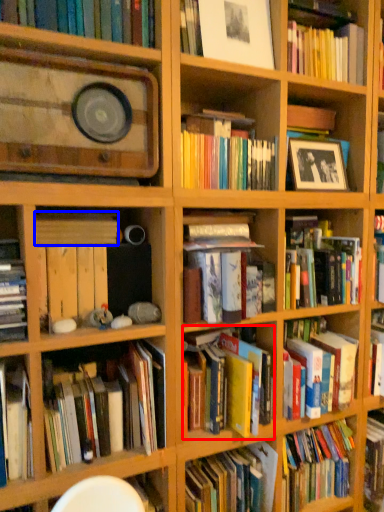
Question: Which object is closer to the camera taking this photo, book (highlighted by a red box) or book (highlighted by a blue box)?

Choices:
 (A) book
 (B) book

Answer: (B)